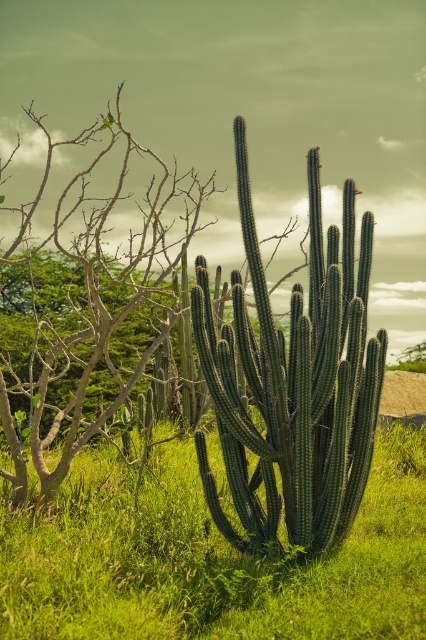
You are standing in the middle of the scene and see the green matte cactus at center and the green matte tree at center. Which one is positioned to the right?

The green matte cactus at center is positioned to the right of the green matte tree at center.